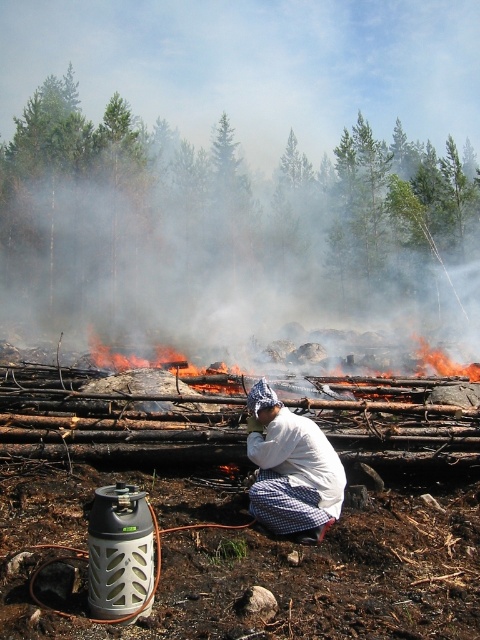
You are a GUI agent. You are given a task and a screenshot of the screen. Output one action in this format:
    pyautogui.click(x=<x>, y=<y>)
    Task: Click on the white cotton shirt at center
    
    Given the screenshot: What is the action you would take?
    pyautogui.click(x=290, y=468)

How much distance is there between white cotton shirt at center and flaming wood at center?

white cotton shirt at center and flaming wood at center are 6.87 meters apart from each other.

Between point (282, 458) and point (447, 372), which one is positioned behind?

The point (447, 372) is behind.

Where is `white cotton shirt at center`? This screenshot has width=480, height=640. white cotton shirt at center is located at coordinates (290, 468).